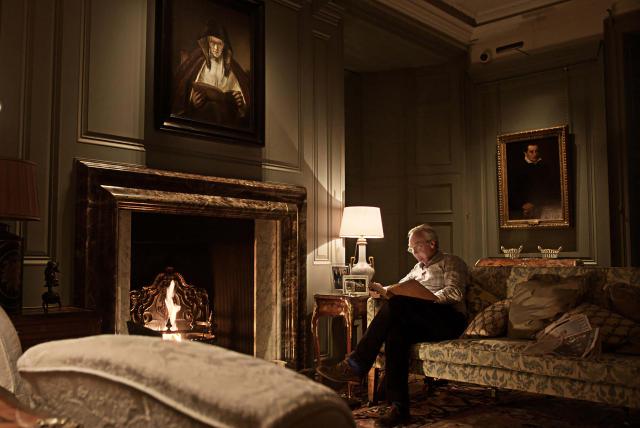
Locate an element on the screen. fireplace is located at coordinates (218, 268).